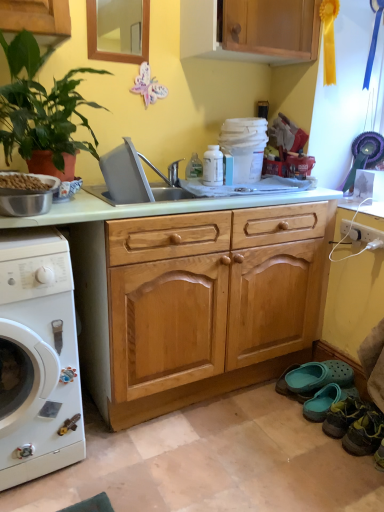
Measure the distance between point (353, 390) and camera.

Point (353, 390) is 6.17 feet from camera.

What is the approximate width of white glossy washing machine at left?

It is 72.38 centimeters.

Describe the element at coordinates (251, 30) in the screenshot. The image size is (384, 512). I see `wooden cabinet at upper center` at that location.

Where is `brown matte dog food at left`? This screenshot has height=512, width=384. brown matte dog food at left is located at coordinates (23, 182).

What are the coordinates of `green leafy plant at left` in the screenshot? It's located at (41, 106).

Would you say teal rubber clog at lower right, the 1th shoe positioned from the back, is to the left or to the right of wooden cabinet at upper center in the picture?

Clearly, teal rubber clog at lower right, the 1th shoe positioned from the back, is on the right of wooden cabinet at upper center in the image.

Could you tell me if teal rubber clog at lower right, which is the 4th shoe in front-to-back order, is turned towards wooden cabinet at upper center?

No, teal rubber clog at lower right, which is the 4th shoe in front-to-back order, is not oriented towards wooden cabinet at upper center.

Does teal rubber clog at lower right, the 1th shoe positioned from the back, touch wooden cabinet at upper center?

teal rubber clog at lower right, the 1th shoe positioned from the back, and wooden cabinet at upper center are clearly separated.

Who is taller, teal rubber clog at lower right, which is the 4th shoe in front-to-back order, or wooden cabinet at upper center?

With more height is wooden cabinet at upper center.

Which of these two, teal rubber clog at lower right, the 2th shoe when ordered from back to front, or leather shoe at lower right, placed as the third shoe when sorted from back to front, stands taller?

leather shoe at lower right, placed as the third shoe when sorted from back to front, is taller.

Based on the photo, from a real-world perspective, is teal rubber clog at lower right, the 2th shoe when ordered from back to front, positioned over leather shoe at lower right, placed as the third shoe when sorted from back to front, based on gravity?

No, from a real-world perspective, teal rubber clog at lower right, the 2th shoe when ordered from back to front, is not above leather shoe at lower right, placed as the third shoe when sorted from back to front.

From the image's perspective, is teal rubber clog at lower right, the 2th shoe when ordered from back to front, located above leather shoe at lower right, which is the second shoe from front to back?

Yes.

Could leather shoe at lower right, placed as the third shoe when sorted from back to front, be considered to be inside teal rubber clog at lower right, the 2th shoe when ordered from back to front?

That's incorrect, leather shoe at lower right, placed as the third shoe when sorted from back to front, is not inside teal rubber clog at lower right, the 2th shoe when ordered from back to front.

Which object is wider, leather shoe at lower right, which is the second shoe from front to back, or teal rubber clog at lower right, the 2th shoe when ordered from back to front?

teal rubber clog at lower right, the 2th shoe when ordered from back to front.

In order to click on the 3rd shoe below the leather shoe at lower right, which is the second shoe from front to back (from a real-world perspective) in this screenshot , I will do `click(326, 401)`.

Is leather shoe at lower right, which is the second shoe from front to back, placed right next to teal rubber clog at lower right, arranged as the third shoe when viewed from the front?

Yes, leather shoe at lower right, which is the second shoe from front to back, is beside teal rubber clog at lower right, arranged as the third shoe when viewed from the front.

You are a GUI agent. You are given a task and a screenshot of the screen. Output one action in this format:
    pyautogui.click(x=<x>, y=<y>)
    Task: Click on the cabinetry that is on the right side of green leafy plant at left
    This screenshot has width=384, height=512.
    Given the screenshot: What is the action you would take?
    pyautogui.click(x=251, y=30)

Relative to wooden cabinet at upper center, is green leafy plant at left in front or behind?

green leafy plant at left is in front of wooden cabinet at upper center.

Is green leafy plant at left facing away from wooden cabinet at upper center?

No, green leafy plant at left is not facing the opposite direction of wooden cabinet at upper center.

How much distance is there between teal rubber clog at lower right, the 2th shoe when ordered from back to front, and white glossy washing machine at left?

teal rubber clog at lower right, the 2th shoe when ordered from back to front, is 3.64 feet from white glossy washing machine at left.

Which of these two, teal rubber clog at lower right, arranged as the third shoe when viewed from the front, or white glossy washing machine at left, is bigger?

With larger size is white glossy washing machine at left.

Identify the location of the 2nd shoe below the white glossy washing machine at left (from the image's perspective). (326, 401).

From the image's perspective, is teal rubber clog at lower right, the 2th shoe when ordered from back to front, located above or below white glossy washing machine at left?

teal rubber clog at lower right, the 2th shoe when ordered from back to front, is below white glossy washing machine at left.

Which is behind, point (336, 433) or point (362, 419)?

The point (336, 433) is farther.

Is leather shoe at lower right, placed as the third shoe when sorted from back to front, facing away from leather shoe at lower right, placed as the first shoe when sorted from front to back?

No.

The width and height of the screenshot is (384, 512). Find the location of `shoe in front of the leather shoe at lower right, placed as the third shoe when sorted from back to front`. shoe in front of the leather shoe at lower right, placed as the third shoe when sorted from back to front is located at coordinates (364, 434).

Is teal rubber clog at lower right, the 1th shoe positioned from the back, aimed at brown matte dog food at left?

No, teal rubber clog at lower right, the 1th shoe positioned from the back, is not oriented towards brown matte dog food at left.

What's the angular difference between teal rubber clog at lower right, the 1th shoe positioned from the back, and brown matte dog food at left's facing directions?

They differ by 71.9 degrees in their facing directions.

Does teal rubber clog at lower right, which is the 4th shoe in front-to-back order, have a lesser width compared to brown matte dog food at left?

In fact, teal rubber clog at lower right, which is the 4th shoe in front-to-back order, might be wider than brown matte dog food at left.

From the image's perspective, starting from the wooden cabinet at upper center, which shoe is the 1st one below? Please provide its 2D coordinates.

[(319, 376)]

From the leather shoe at lower right, placed as the third shoe when sorted from back to front, count the 1st shoe to the left and point to it. Please provide its 2D coordinates.

[(326, 401)]

From the image, which object appears to be farther from leather shoe at lower right, placed as the third shoe when sorted from back to front, teal rubber clog at lower right, the 2th shoe when ordered from back to front, or brown matte dog food at left?

Based on the image, brown matte dog food at left appears to be further to leather shoe at lower right, placed as the third shoe when sorted from back to front.

When comparing their distances from teal rubber clog at lower right, arranged as the third shoe when viewed from the front, does leather shoe at lower right, the 4th shoe viewed from the back, or teal rubber clog at lower right, which is the 4th shoe in front-to-back order, seem closer?

teal rubber clog at lower right, which is the 4th shoe in front-to-back order, is closer to teal rubber clog at lower right, arranged as the third shoe when viewed from the front.

Looking at the image, which one is located closer to teal rubber clog at lower right, the 1th shoe positioned from the back, green leafy plant at left or leather shoe at lower right, which is the second shoe from front to back?

Among the two, leather shoe at lower right, which is the second shoe from front to back, is located nearer to teal rubber clog at lower right, the 1th shoe positioned from the back.

When comparing their distances from leather shoe at lower right, which is the second shoe from front to back, does teal rubber clog at lower right, the 2th shoe when ordered from back to front, or white glossy washing machine at left seem closer?

The object closer to leather shoe at lower right, which is the second shoe from front to back, is teal rubber clog at lower right, the 2th shoe when ordered from back to front.

Estimate the real-world distances between objects in this image. Which object is closer to green leafy plant at left, white glossy washing machine at left or leather shoe at lower right, placed as the first shoe when sorted from front to back?

Based on the image, white glossy washing machine at left appears to be nearer to green leafy plant at left.

When comparing their distances from leather shoe at lower right, the 4th shoe viewed from the back, does leather shoe at lower right, which is the second shoe from front to back, or teal rubber clog at lower right, arranged as the third shoe when viewed from the front, seem closer?

The object closer to leather shoe at lower right, the 4th shoe viewed from the back, is leather shoe at lower right, which is the second shoe from front to back.

Considering their positions, is green leafy plant at left positioned closer to leather shoe at lower right, placed as the first shoe when sorted from front to back, than brown matte dog food at left?

brown matte dog food at left lies closer to leather shoe at lower right, placed as the first shoe when sorted from front to back, than the other object.

Looking at the image, which one is located further to teal rubber clog at lower right, the 1th shoe positioned from the back, leather shoe at lower right, the 4th shoe viewed from the back, or leather shoe at lower right, which is the second shoe from front to back?

Based on the image, leather shoe at lower right, the 4th shoe viewed from the back, appears to be further to teal rubber clog at lower right, the 1th shoe positioned from the back.

The image size is (384, 512). Identify the location of shoe situated between green leafy plant at left and teal rubber clog at lower right, the 2th shoe when ordered from back to front, from left to right. (319, 376).

Find the location of a particular element. food situated between white glossy washing machine at left and teal rubber clog at lower right, the 2th shoe when ordered from back to front, from left to right is located at coordinates (23, 182).

This screenshot has width=384, height=512. In order to click on food that lies between wooden cabinet at upper center and leather shoe at lower right, placed as the first shoe when sorted from front to back, from top to bottom in this screenshot , I will do `click(23, 182)`.

This screenshot has width=384, height=512. I want to click on food situated between white glossy washing machine at left and leather shoe at lower right, which is the second shoe from front to back, from left to right, so click(x=23, y=182).